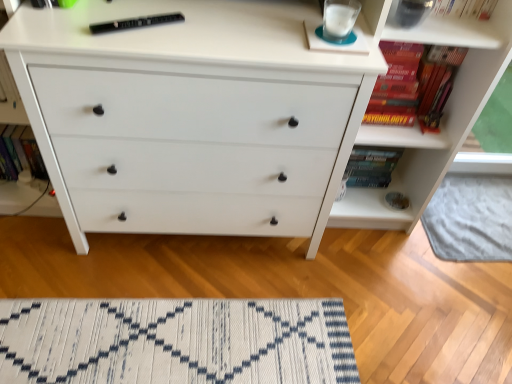
Locate an element on the screen. The width and height of the screenshot is (512, 384). vacant space to the left of black plastic remote at upper center, placed as the second book when sorted from left to right is located at coordinates (71, 23).